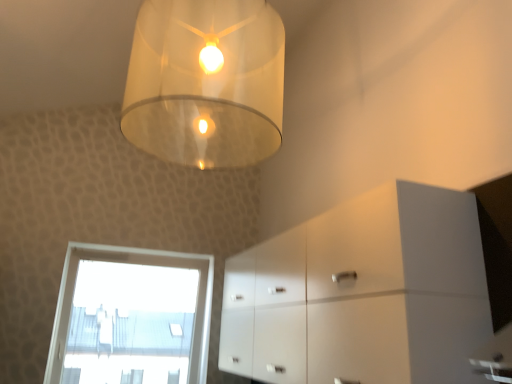
Question: Is white glossy cabinet at lower right far from transparent glass window at lower left?

Choices:
 (A) no
 (B) yes

Answer: (B)

Question: Can you confirm if white glossy cabinet at lower right is positioned to the left of transparent glass window at lower left?

Choices:
 (A) yes
 (B) no

Answer: (B)

Question: Does white glossy cabinet at lower right turn towards transparent glass window at lower left?

Choices:
 (A) no
 (B) yes

Answer: (A)

Question: Can you confirm if white glossy cabinet at lower right is thinner than transparent glass window at lower left?

Choices:
 (A) no
 (B) yes

Answer: (A)

Question: Can you confirm if white glossy cabinet at lower right is wider than transparent glass window at lower left?

Choices:
 (A) no
 (B) yes

Answer: (B)

Question: From a real-world perspective, is translucent glass lampshade at upper center physically located above or below white glossy cabinet at lower right?

Choices:
 (A) below
 (B) above

Answer: (B)

Question: Considering their positions, is translucent glass lampshade at upper center located in front of or behind white glossy cabinet at lower right?

Choices:
 (A) front
 (B) behind

Answer: (A)

Question: In terms of size, does translucent glass lampshade at upper center appear bigger or smaller than white glossy cabinet at lower right?

Choices:
 (A) small
 (B) big

Answer: (A)

Question: Is translucent glass lampshade at upper center to the left or to the right of white glossy cabinet at lower right in the image?

Choices:
 (A) left
 (B) right

Answer: (A)

Question: Is white glossy cabinet at lower right taller or shorter than translucent glass lampshade at upper center?

Choices:
 (A) short
 (B) tall

Answer: (A)

Question: Is white glossy cabinet at lower right wider or thinner than translucent glass lampshade at upper center?

Choices:
 (A) wide
 (B) thin

Answer: (B)

Question: From the image's perspective, is white glossy cabinet at lower right located above or below translucent glass lampshade at upper center?

Choices:
 (A) above
 (B) below

Answer: (B)

Question: Considering the positions of white glossy cabinet at lower right and translucent glass lampshade at upper center in the image, is white glossy cabinet at lower right bigger or smaller than translucent glass lampshade at upper center?

Choices:
 (A) big
 (B) small

Answer: (A)

Question: From a real-world perspective, relative to white glossy cabinet at lower right, is transparent glass window at lower left vertically above or below?

Choices:
 (A) above
 (B) below

Answer: (B)

Question: Is point (180, 345) closer or farther from the camera than point (432, 372)?

Choices:
 (A) closer
 (B) farther

Answer: (B)